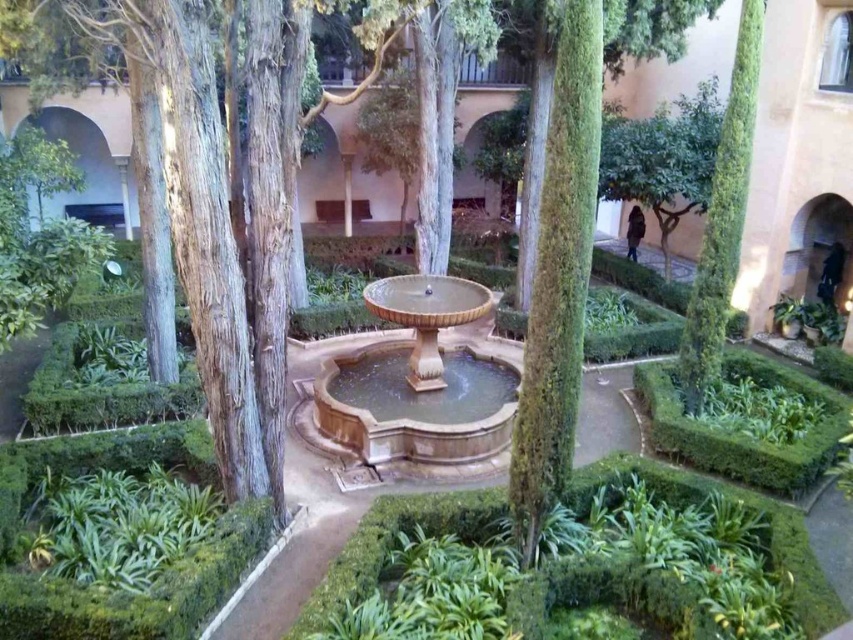
Question: Which point is farther to the camera?

Choices:
 (A) green leafy tree at right
 (B) brown stone fountain at center

Answer: (B)

Question: Which object is closer to the camera taking this photo?

Choices:
 (A) brown stone fountain at center
 (B) green leafy tree at right

Answer: (B)

Question: Considering the relative positions of brown stone fountain at center and green leafy tree at right in the image provided, where is brown stone fountain at center located with respect to green leafy tree at right?

Choices:
 (A) right
 (B) left

Answer: (B)

Question: Can you confirm if brown stone fountain at center is positioned to the left of green leafy tree at right?

Choices:
 (A) yes
 (B) no

Answer: (A)

Question: Which of the following is the closest to the observer?

Choices:
 (A) green leafy tree at right
 (B) brown stone fountain at center

Answer: (A)

Question: In this image, where is brown stone fountain at center located relative to green leafy tree at right?

Choices:
 (A) above
 (B) below

Answer: (B)